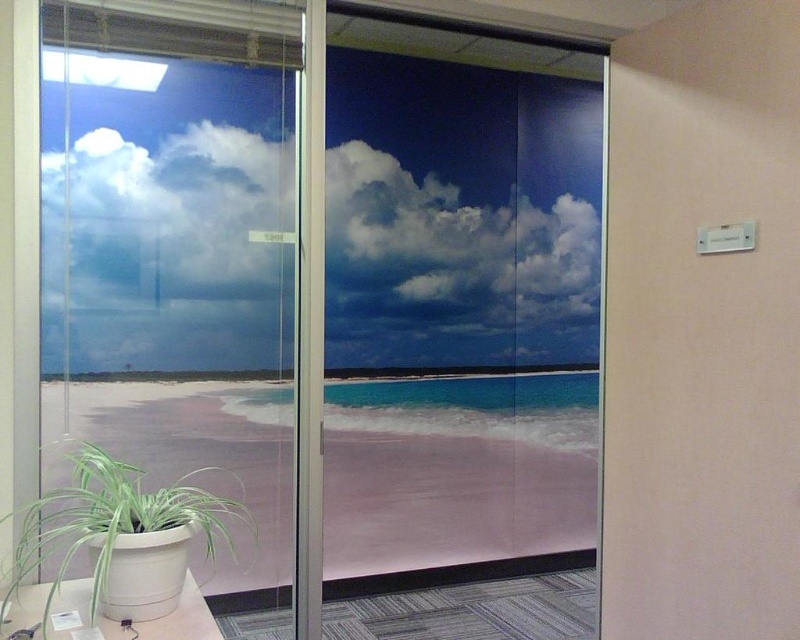
Question: Is white fluffy cloud at upper center wider than transparent glass door at left?

Choices:
 (A) yes
 (B) no

Answer: (A)

Question: Does white fluffy cloud at upper center come behind transparent glass door at left?

Choices:
 (A) yes
 (B) no

Answer: (A)

Question: Which point is farther to the camera?

Choices:
 (A) (186, 176)
 (B) (282, 573)
 (C) (400, 376)
 (D) (126, 614)

Answer: (C)

Question: Which of these objects is positioned farthest from the transparent glass door at center?

Choices:
 (A) transparent glass door at left
 (B) white fluffy cloud at upper center
 (C) green leafy plant at lower left

Answer: (C)

Question: Is transparent glass door at center to the left of white fluffy cloud at upper center from the viewer's perspective?

Choices:
 (A) no
 (B) yes

Answer: (A)

Question: Which point appears closest to the camera in this image?

Choices:
 (A) pyautogui.click(x=26, y=568)
 (B) pyautogui.click(x=72, y=432)
 (C) pyautogui.click(x=64, y=259)

Answer: (A)